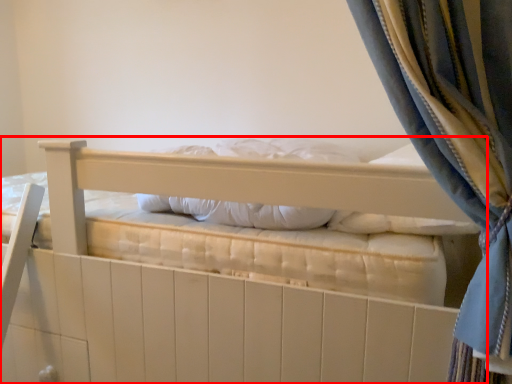
Question: From the image, what is the correct spatial relationship of bed (annotated by the red box) in relation to pillow?

Choices:
 (A) left
 (B) right

Answer: (A)